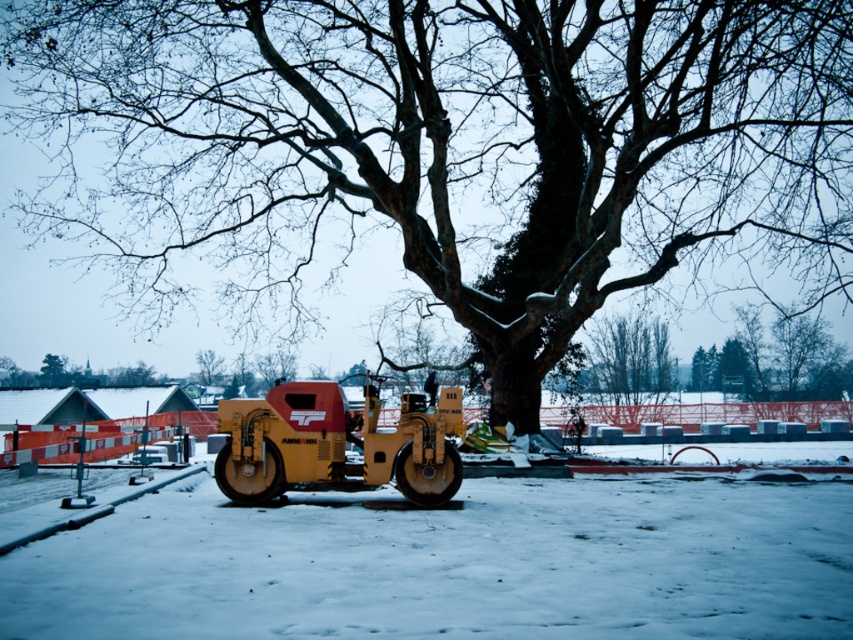
In the scene shown: Does white matte snow at center have a greater height compared to green leafy tree at center?

In fact, white matte snow at center may be shorter than green leafy tree at center.

Between point (793, 544) and point (207, 349), which one is positioned behind?

Positioned behind is point (207, 349).

This screenshot has width=853, height=640. What are the coordinates of `white matte snow at center` in the screenshot? It's located at point(451,563).

Is white matte snow at center to the left of yellow rubber steamroller at center from the viewer's perspective?

Incorrect, white matte snow at center is not on the left side of yellow rubber steamroller at center.

Between white matte snow at center and yellow rubber steamroller at center, which one is positioned higher?

Positioned higher is yellow rubber steamroller at center.

Image resolution: width=853 pixels, height=640 pixels. What do you see at coordinates (451, 563) in the screenshot? I see `white matte snow at center` at bounding box center [451, 563].

At what (x,y) coordinates should I click in order to perform the action: click on white matte snow at center. Please return your answer as a coordinate pair (x, y). The height and width of the screenshot is (640, 853). Looking at the image, I should click on (451, 563).

Is smooth bark tree at center above green leafy tree at center?

Correct, smooth bark tree at center is located above green leafy tree at center.

Describe the element at coordinates (450, 145) in the screenshot. I see `smooth bark tree at center` at that location.

Find the location of a particular element. The image size is (853, 640). smooth bark tree at center is located at coordinates (450, 145).